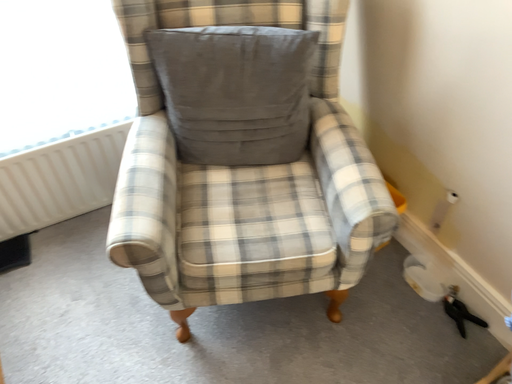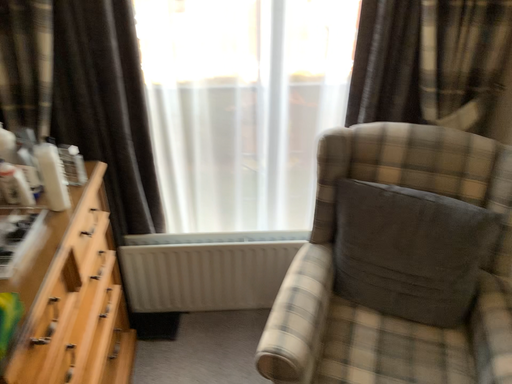
Question: How did the camera likely rotate when shooting the video?

Choices:
 (A) rotated downward
 (B) rotated upward

Answer: (B)